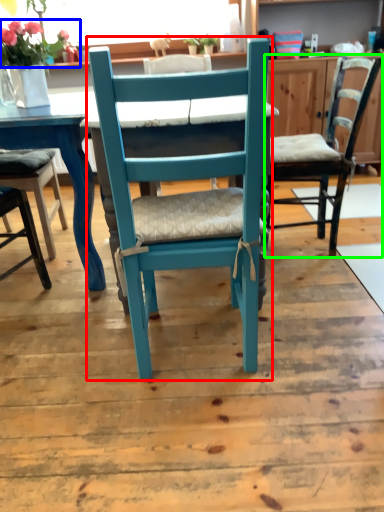
Question: Which object is positioned farthest from chair (highlighted by a red box)? Select from flower (highlighted by a blue box) and chair (highlighted by a green box).

Choices:
 (A) flower
 (B) chair

Answer: (A)